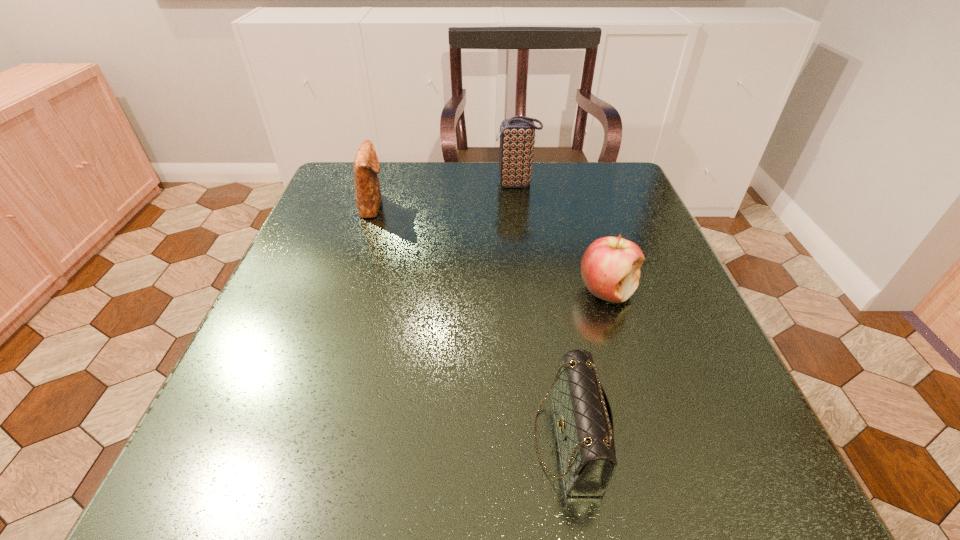
Image resolution: width=960 pixels, height=540 pixels. In order to click on free spot between the leftmost object and the farthest clutch bag in this screenshot , I will do `click(444, 195)`.

Where is `blank region between the leftmost clutch bag and the shortest object`? blank region between the leftmost clutch bag and the shortest object is located at coordinates (470, 322).

Identify the location of vacant area between the leftmost clutch bag and the nearest object. [x=470, y=322].

You are a GUI agent. You are given a task and a screenshot of the screen. Output one action in this format:
    pyautogui.click(x=<x>, y=<y>)
    Task: Click on the free space between the tallest clutch bag and the leftmost object
    
    Given the screenshot: What is the action you would take?
    pyautogui.click(x=444, y=195)

Image resolution: width=960 pixels, height=540 pixels. I want to click on object that is the second closest to the tallest clutch bag, so click(x=610, y=267).

The image size is (960, 540). What are the coordinates of `object identified as the closest to the rightmost object` in the screenshot? It's located at (584, 419).

Identify which clutch bag is the second nearest to the second shortest clutch bag. Please provide its 2D coordinates. Your answer should be formatted as a tuple, i.e. [(x, y)], where the tuple contains the x and y coordinates of a point satisfying the conditions above.

[(584, 419)]

Where is `the closest clutch bag to the farthest clutch bag`? Image resolution: width=960 pixels, height=540 pixels. the closest clutch bag to the farthest clutch bag is located at coordinates (366, 165).

The height and width of the screenshot is (540, 960). What are the coordinates of `vacant position in the image that satisfies the following two spatial constraints: 1. with the zip open on the apple; 2. on the left side of the farthest clutch bag` in the screenshot? It's located at (529, 291).

You are a GUI agent. You are given a task and a screenshot of the screen. Output one action in this format:
    pyautogui.click(x=<x>, y=<y>)
    Task: Click on the vacant point that satisfies the following two spatial constraints: 1. on the back side of the rightmost object; 2. on the open side of the second tallest clutch bag
    Image resolution: width=960 pixels, height=540 pixels.
    Given the screenshot: What is the action you would take?
    pyautogui.click(x=581, y=206)